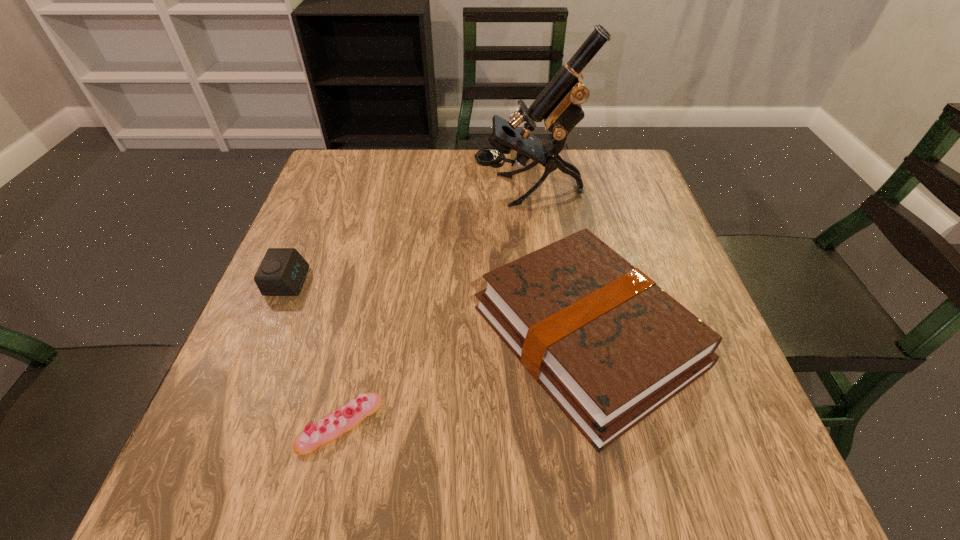
Locate an element on the screen. This screenshot has height=540, width=960. free space that satisfies the following two spatial constraints: 1. on the front-facing side of the hardback book; 2. on the left side of the leftmost object is located at coordinates (265, 336).

I want to click on vacant position in the image that satisfies the following two spatial constraints: 1. on the back side of the second object from left to right; 2. on the left side of the second tallest object, so pos(361,336).

Locate an element on the screen. vacant space that satisfies the following two spatial constraints: 1. on the front-facing side of the third shortest object; 2. on the right side of the alarm clock is located at coordinates click(265, 336).

Locate an element on the screen. This screenshot has height=540, width=960. free space that satisfies the following two spatial constraints: 1. through the eyepiece of the tallest object; 2. on the left side of the hardback book is located at coordinates (547, 336).

At what (x,y) coordinates should I click in order to perform the action: click on vacant space that satisfies the following two spatial constraints: 1. on the front-facing side of the eclair; 2. on the left side of the third tallest object. Please return your answer as a coordinate pair (x, y). The width and height of the screenshot is (960, 540). Looking at the image, I should click on (228, 424).

What are the coordinates of `vacant region that satisfies the following two spatial constraints: 1. on the front-facing side of the shortest object; 2. on the left side of the second shortest object` in the screenshot? It's located at (228, 424).

Where is `free space that satisfies the following two spatial constraints: 1. on the front-facing side of the leftmost object; 2. on the back side of the hardback book`? The height and width of the screenshot is (540, 960). free space that satisfies the following two spatial constraints: 1. on the front-facing side of the leftmost object; 2. on the back side of the hardback book is located at coordinates (265, 336).

Locate an element on the screen. Image resolution: width=960 pixels, height=540 pixels. vacant region that satisfies the following two spatial constraints: 1. on the front-facing side of the alarm clock; 2. on the left side of the second tallest object is located at coordinates (265, 336).

At what (x,y) coordinates should I click in order to perform the action: click on free point that satisfies the following two spatial constraints: 1. on the front-facing side of the hardback book; 2. on the right side of the leftmost object. Please return your answer as a coordinate pair (x, y). Looking at the image, I should click on (265, 336).

Where is `free location that satisfies the following two spatial constraints: 1. through the eyepiece of the second tallest object; 2. on the left side of the farthest object`? This screenshot has height=540, width=960. free location that satisfies the following two spatial constraints: 1. through the eyepiece of the second tallest object; 2. on the left side of the farthest object is located at coordinates (547, 336).